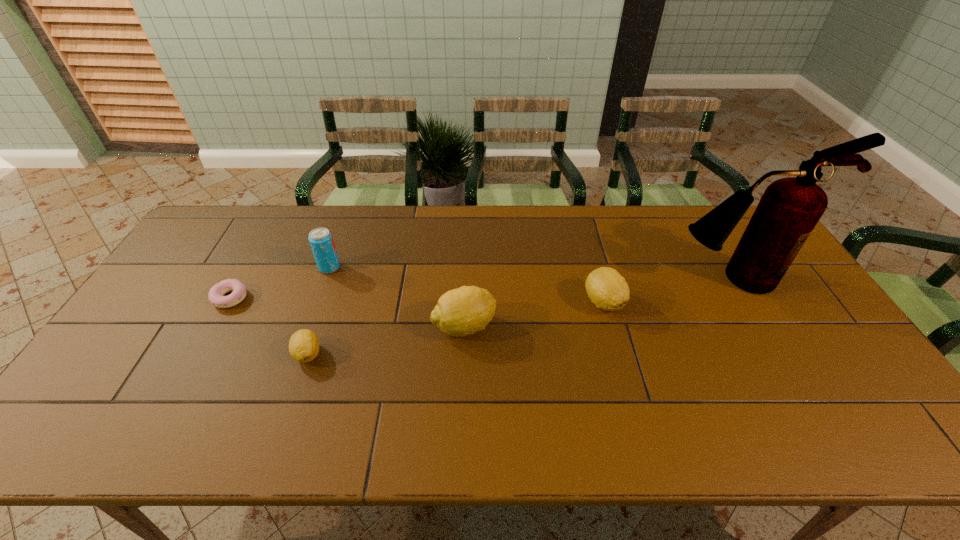
Identify which object is the fourth nearest to the second object from right to left. Please provide its 2D coordinates. Your answer should be formatted as a tuple, i.e. [(x, y)], where the tuple contains the x and y coordinates of a point satisfying the conditions above.

[(321, 241)]

This screenshot has height=540, width=960. In order to click on the fifth closest object relative to the second lemon from right to left in this screenshot , I will do `click(216, 293)`.

Locate which lemon is the second closest to the rightmost object. Please provide its 2D coordinates. Your answer should be formatted as a tuple, i.e. [(x, y)], where the tuple contains the x and y coordinates of a point satisfying the conditions above.

[(463, 311)]

You are a GUI agent. You are given a task and a screenshot of the screen. Output one action in this format:
    pyautogui.click(x=<x>, y=<y>)
    Task: Click on the lemon that stands as the second closest to the third object from right to left
    
    Given the screenshot: What is the action you would take?
    pyautogui.click(x=304, y=345)

Find the location of a particular element. This screenshot has width=960, height=540. vacant space that satisfies the following two spatial constraints: 1. at the stem end of the fifth object from left to right; 2. at the stem end of the fourth object from left to right is located at coordinates (611, 326).

At what (x,y) coordinates should I click in order to perform the action: click on vacant space that satisfies the following two spatial constraints: 1. at the stem end of the third shortest object; 2. at the stem end of the second lemon from left to right. Please return your answer as a coordinate pair (x, y). The width and height of the screenshot is (960, 540). Looking at the image, I should click on (611, 326).